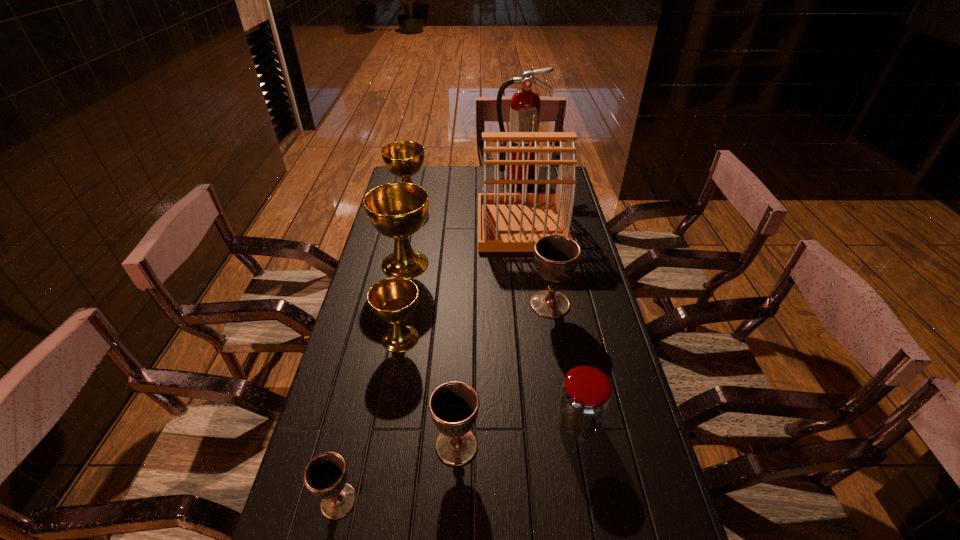
The image size is (960, 540). Identify the location of chalice that is the fifth closest to the beige birdcage. (453, 406).

The width and height of the screenshot is (960, 540). I want to click on the second closest gold chalice relative to the farthest gold chalice, so click(x=393, y=300).

Point out which gold chalice is positioned as the second nearest to the fourth nearest object. Please provide its 2D coordinates. Your answer should be formatted as a tuple, i.e. [(x, y)], where the tuple contains the x and y coordinates of a point satisfying the conditions above.

[(404, 159)]

You are a GUI agent. You are given a task and a screenshot of the screen. Output one action in this format:
    pyautogui.click(x=<x>, y=<y>)
    Task: Click on the brown chalice identified as the second closest to the smallest brown chalice
    The width and height of the screenshot is (960, 540).
    Given the screenshot: What is the action you would take?
    pyautogui.click(x=556, y=257)

Point out which brown chalice is positioned as the nearest to the fifth chalice from left to right. Please provide its 2D coordinates. Your answer should be formatted as a tuple, i.e. [(x, y)], where the tuple contains the x and y coordinates of a point satisfying the conditions above.

[(325, 475)]

Locate an element on the screen. free space that satisfies the following two spatial constraints: 1. with an open door on the beige birdcage; 2. on the front side of the second smallest brown chalice is located at coordinates (549, 446).

Image resolution: width=960 pixels, height=540 pixels. I want to click on free space that satisfies the following two spatial constraints: 1. with an open door on the fifth farthest object; 2. on the left side of the birdcage, so click(x=532, y=304).

Where is `free space that satisfies the following two spatial constraints: 1. on the nozzle side of the fire extinguisher; 2. on the right side of the rightmost chalice`? The height and width of the screenshot is (540, 960). free space that satisfies the following two spatial constraints: 1. on the nozzle side of the fire extinguisher; 2. on the right side of the rightmost chalice is located at coordinates (538, 304).

Locate an element on the screen. Image resolution: width=960 pixels, height=540 pixels. vacant space that satisfies the following two spatial constraints: 1. on the nozzle side of the fire extinguisher; 2. with an open door on the birdcage is located at coordinates [526, 225].